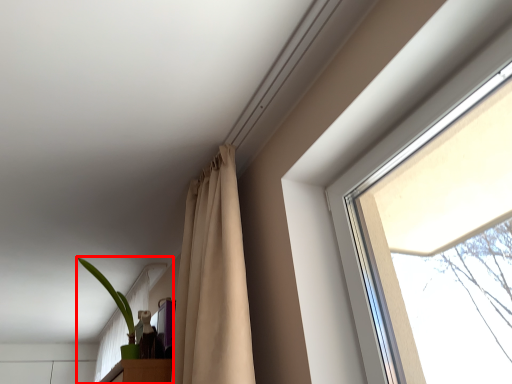
Question: From the image's perspective, what is the correct spatial relationship of houseplant (annotated by the red box) in relation to curtain?

Choices:
 (A) below
 (B) above

Answer: (A)